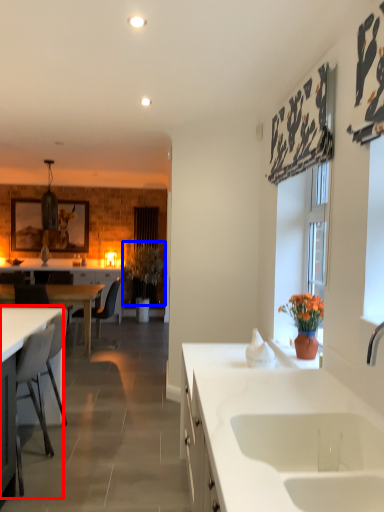
Question: Which point is closer to the camera, desk (highlighted by a red box) or plant (highlighted by a blue box)?

Choices:
 (A) desk
 (B) plant

Answer: (A)